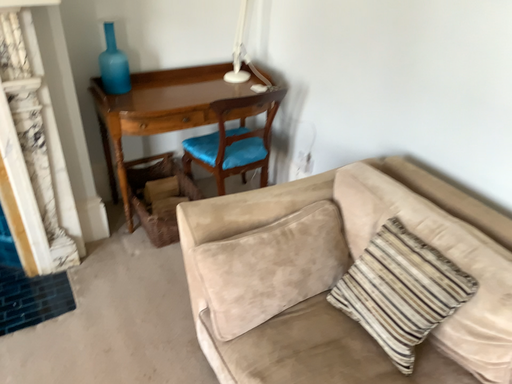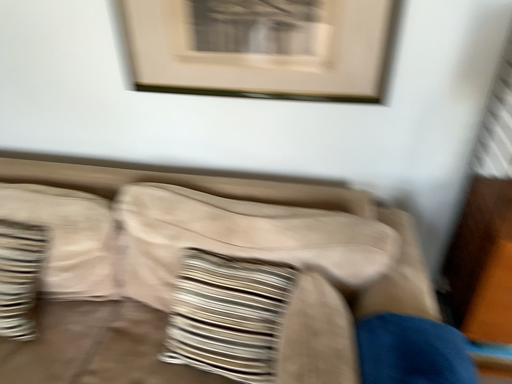
Question: Which way did the camera rotate in the video?

Choices:
 (A) rotated right
 (B) rotated left

Answer: (A)